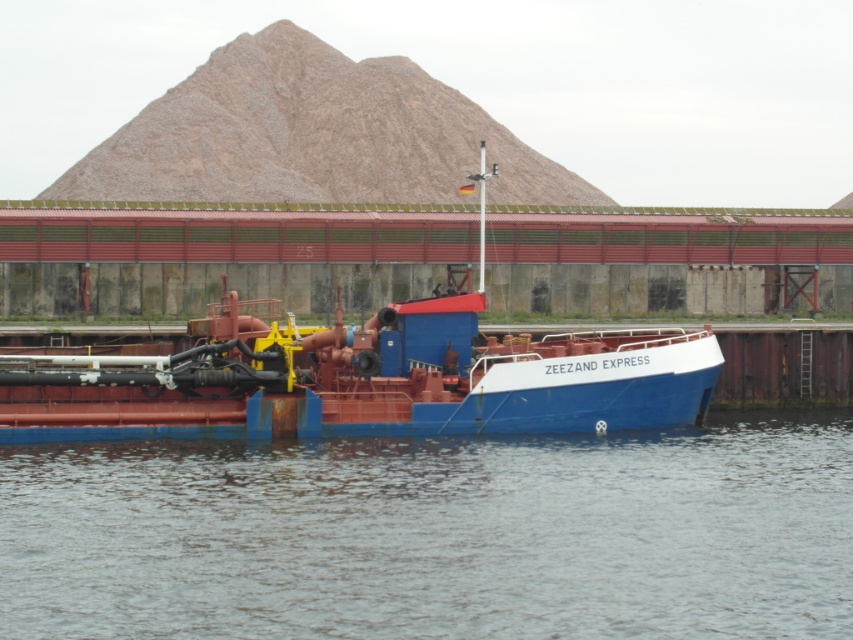
Who is lower down, transparent water at lower center or blue matte barge at center?

Positioned lower is transparent water at lower center.

From the picture: Is transparent water at lower center further to camera compared to blue matte barge at center?

No, transparent water at lower center is in front of blue matte barge at center.

Locate an element on the screen. Image resolution: width=853 pixels, height=640 pixels. transparent water at lower center is located at coordinates (436, 536).